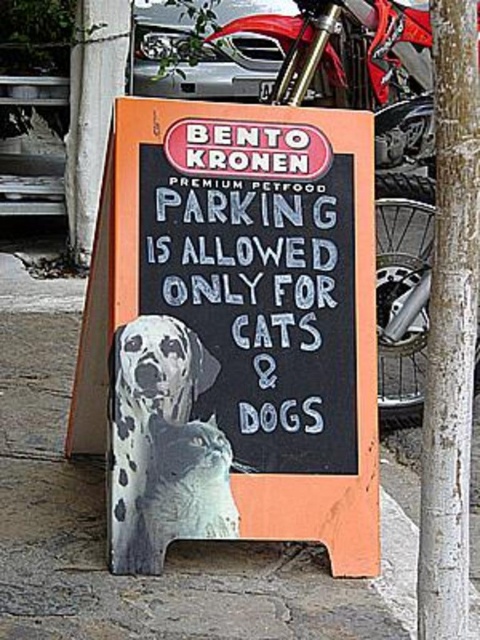
Question: Which of the following is the farthest from the observer?

Choices:
 (A) orange wood sign at center
 (B) white chalk/blackboard at center

Answer: (B)

Question: Is spotted fur dog at center positioned behind white fur dog at center?

Choices:
 (A) no
 (B) yes

Answer: (B)

Question: Which of the following is the farthest from the observer?

Choices:
 (A) white chalk/blackboard at center
 (B) white fur dog at center

Answer: (A)

Question: Where is orange wood sign at center located in relation to white textured tree trunk at center-right in the image?

Choices:
 (A) left
 (B) right

Answer: (A)

Question: Which of these objects is positioned farthest from the orange wood sign at center?

Choices:
 (A) white chalk/blackboard at center
 (B) white textured tree trunk at center-right

Answer: (B)

Question: In this image, where is orange wood sign at center located relative to spotted fur dog at center?

Choices:
 (A) below
 (B) above

Answer: (B)